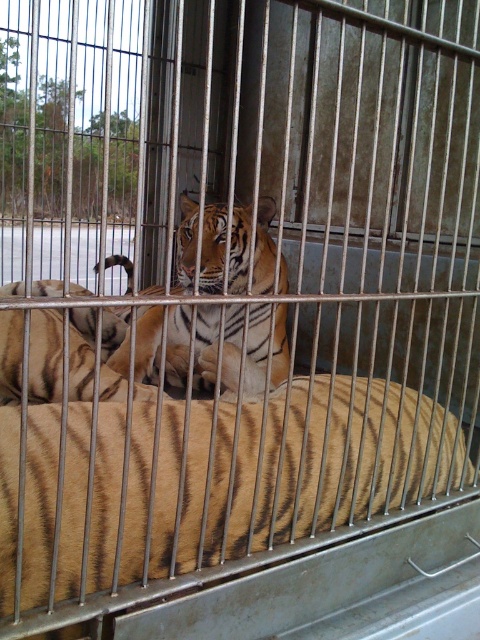
Does orange-brown striped tiger at center have a greater width compared to yellow striped tiger at center?

Correct, the width of orange-brown striped tiger at center exceeds that of yellow striped tiger at center.

Which of these two, orange-brown striped tiger at center or yellow striped tiger at center, stands taller?

Standing taller between the two is yellow striped tiger at center.

Does point (372, 492) come behind point (223, 204)?

No, (372, 492) is in front of (223, 204).

Where is `orange-brown striped tiger at center`? Image resolution: width=480 pixels, height=640 pixels. orange-brown striped tiger at center is located at coordinates (206, 480).